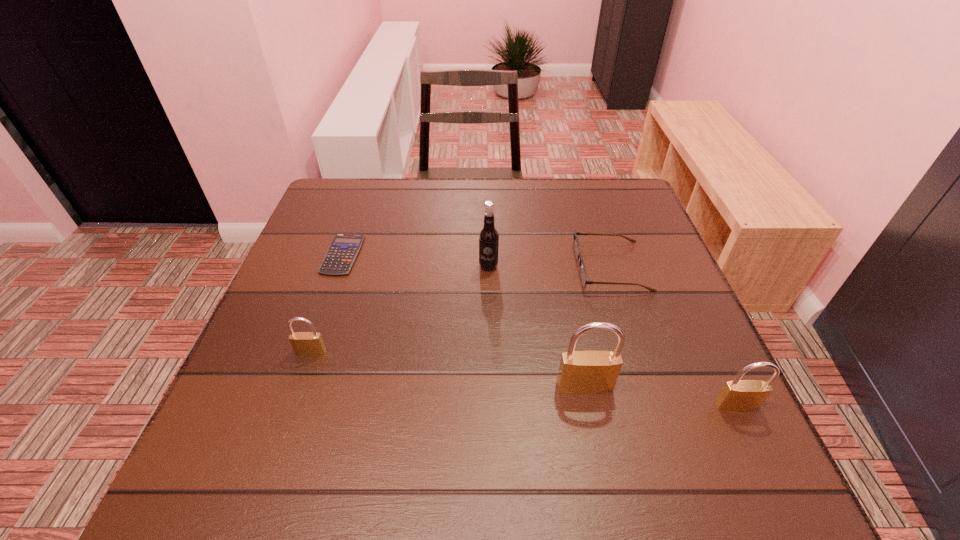
Where is `empty space that is in between the root beer and the shortest object`? empty space that is in between the root beer and the shortest object is located at coordinates (416, 260).

You are a GUI agent. You are given a task and a screenshot of the screen. Output one action in this format:
    pyautogui.click(x=<x>, y=<y>)
    Task: Click on the free space between the fifth tallest object and the root beer
    This screenshot has height=540, width=960.
    Given the screenshot: What is the action you would take?
    pyautogui.click(x=550, y=267)

Locate an element on the screen. free area in between the spectacles and the shortest object is located at coordinates (477, 261).

Find the location of a particular element. unoccupied position between the fifth farthest object and the third shortest object is located at coordinates pyautogui.click(x=447, y=369).

Identify the location of free space between the root beer and the shortest object. (416, 260).

Locate an element on the screen. vacant point located between the shortest padlock and the root beer is located at coordinates (399, 309).

Where is `object identified as the third closest to the second tallest padlock`? This screenshot has height=540, width=960. object identified as the third closest to the second tallest padlock is located at coordinates (488, 237).

Identify which object is located as the third nearest to the spectacles. Please provide its 2D coordinates. Your answer should be formatted as a tuple, i.e. [(x, y)], where the tuple contains the x and y coordinates of a point satisfying the conditions above.

[(738, 395)]

Find the location of a particular element. padlock that is the nearest to the calculator is located at coordinates (304, 343).

Identify which padlock is the closest to the shortest object. Please provide its 2D coordinates. Your answer should be formatted as a tuple, i.e. [(x, y)], where the tuple contains the x and y coordinates of a point satisfying the conditions above.

[(304, 343)]